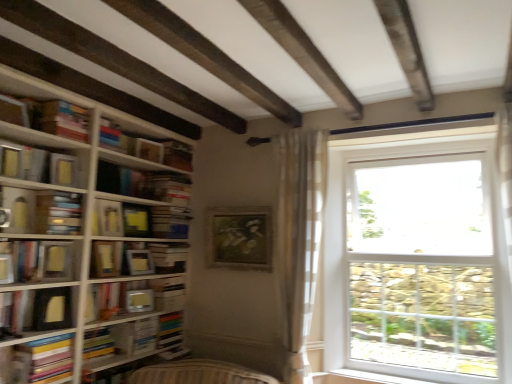
Find the location of a particular element. free point above wooden picture frame at center (from a real-world perspective) is located at coordinates (237, 205).